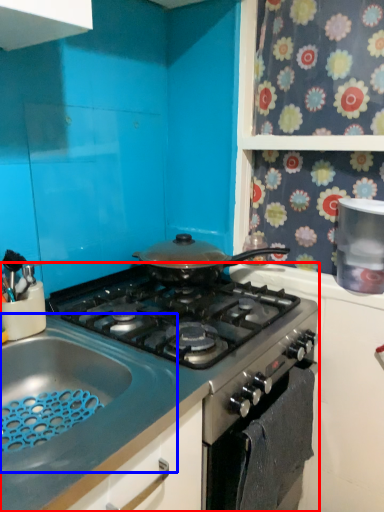
Question: Which object is closer to the camera taking this photo, gas stove (highlighted by a red box) or sink (highlighted by a blue box)?

Choices:
 (A) gas stove
 (B) sink

Answer: (B)